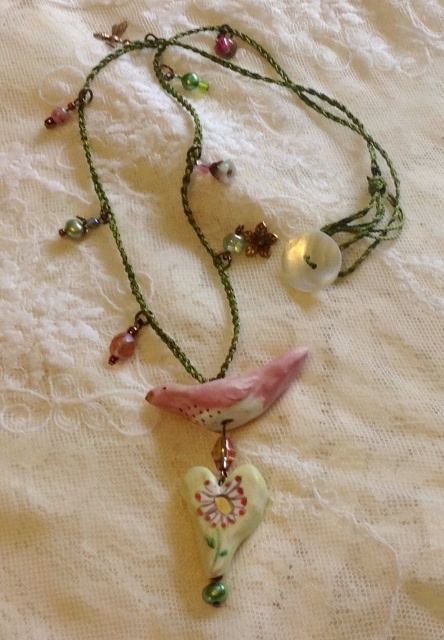
Can you confirm if porcelain heart at center is positioned above matte pink clay bird at center?

Yes, porcelain heart at center is above matte pink clay bird at center.

Which is behind, point (181, 356) or point (206, 381)?

Point (181, 356)

This screenshot has height=640, width=444. What do you see at coordinates (199, 157) in the screenshot?
I see `porcelain heart at center` at bounding box center [199, 157].

Find the location of `porcelain heart at center`. porcelain heart at center is located at coordinates (199, 157).

Does matte pink clay bird at center have a larger size compared to porcelain flower at center?

Yes, matte pink clay bird at center is bigger than porcelain flower at center.

Is matte pink clay bird at center wider than porcelain flower at center?

Yes, matte pink clay bird at center is wider than porcelain flower at center.

Is point (182, 394) behind point (233, 512)?

Yes.

Find the location of a particular element. The height and width of the screenshot is (640, 444). matte pink clay bird at center is located at coordinates (230, 394).

Is point (95, 189) less distant than point (226, 506)?

That is False.

Between point (178, 93) and point (240, 481), which one is positioned in front?

Point (240, 481) is in front.

The image size is (444, 640). What do you see at coordinates (199, 157) in the screenshot?
I see `porcelain heart at center` at bounding box center [199, 157].

Identify the location of porcelain heart at center. (199, 157).